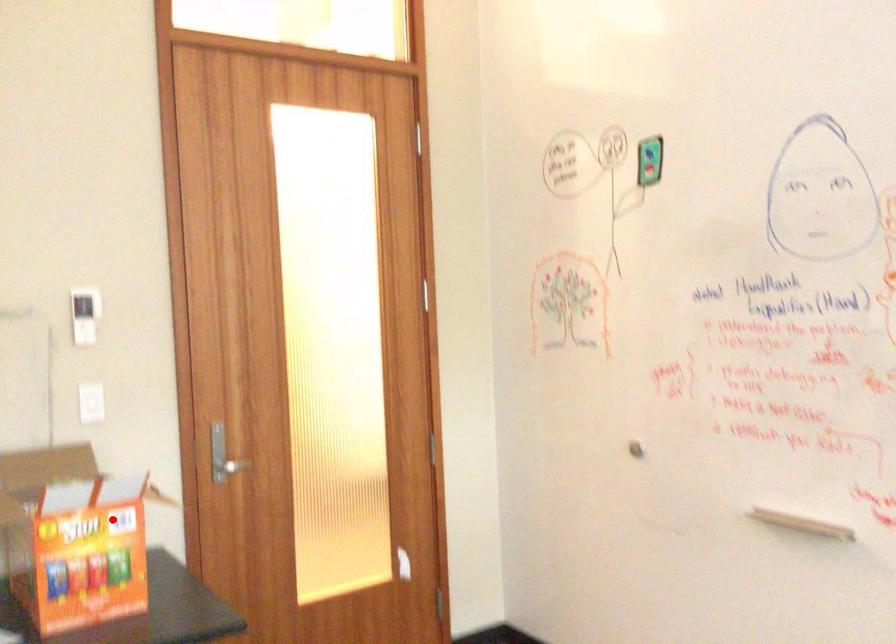
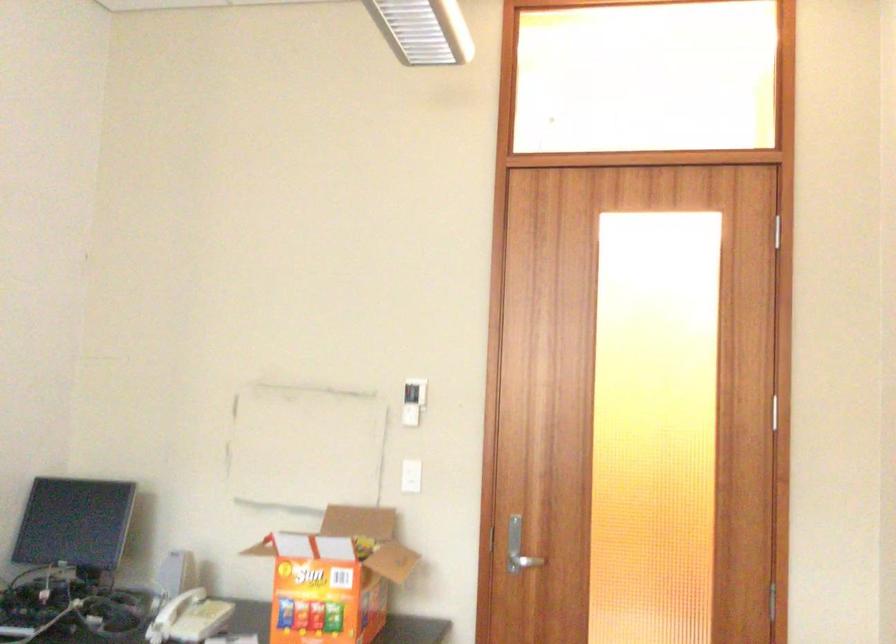
Question: I am providing you with two images of the same scene from different viewpoints. Given a red point in image1, look at the same physical point in image2. Is it:

Choices:
 (A) Closer to the viewpoint
 (B) Farther from the viewpoint

Answer: (B)